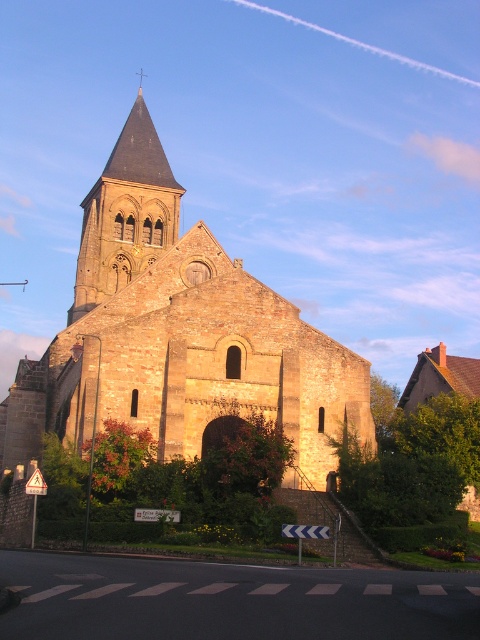
You are a tourist standing in front of the historic stone church. You notice the golden stone tower at upper center and the gold stone spire at upper center. Which one is located to the right side?

The golden stone tower at upper center is positioned on the right side of the gold stone spire at upper center, so the golden stone tower at upper center is located to the right side.